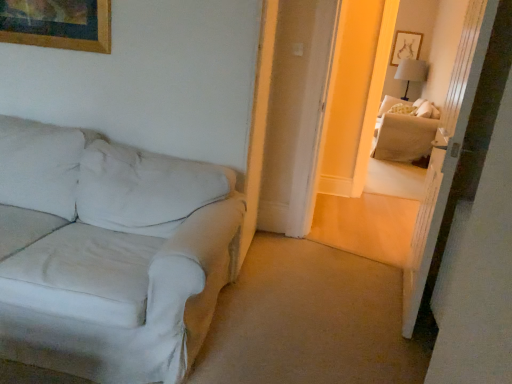
Question: Looking at the image, does gray fabric table lamp at upper right seem bigger or smaller compared to transparent glass door at upper right?

Choices:
 (A) big
 (B) small

Answer: (B)

Question: Is point (402, 66) positioned closer to the camera than point (411, 253)?

Choices:
 (A) closer
 (B) farther

Answer: (B)

Question: Estimate the real-world distances between objects in this image. Which object is closer to the transparent glass door at upper right?

Choices:
 (A) gray fabric table lamp at upper right
 (B) white fabric couch at left
 (C) beige fabric couch at right

Answer: (B)

Question: Based on their relative distances, which object is farther from the white fabric couch at left?

Choices:
 (A) beige fabric couch at right
 (B) gray fabric table lamp at upper right
 (C) transparent glass door at upper right

Answer: (B)